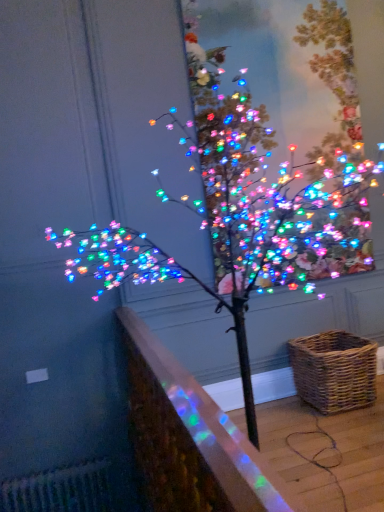
Question: Is point (269, 145) closer or farther from the camera than point (316, 398)?

Choices:
 (A) farther
 (B) closer

Answer: (A)

Question: From their relative heights in the image, would you say multicolored lights at upper center is taller or shorter than woven brown picnic basket at lower right?

Choices:
 (A) short
 (B) tall

Answer: (B)

Question: Which object is positioned farthest from the translucent glass railing at lower left?

Choices:
 (A) woven brown picnic basket at lower right
 (B) multicolored lights at upper center

Answer: (A)

Question: Considering the real-world distances, which object is closest to the woven brown picnic basket at lower right?

Choices:
 (A) multicolored lights at upper center
 (B) translucent glass railing at lower left

Answer: (A)